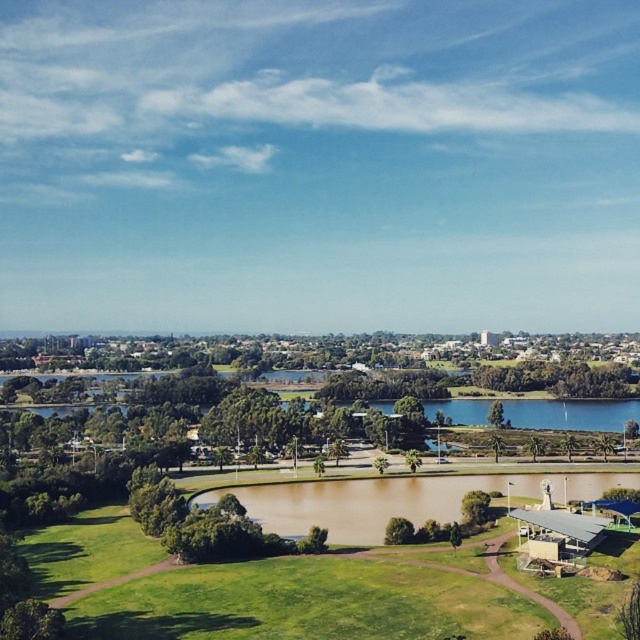
You are planning to host a picnic and need a spacious area. Based on the scene, which location between the green grassy golf course at lower left and the brown matte water at center would be more suitable for setting up your picnic spot?

The green grassy golf course at lower left is more suitable for a picnic spot because it has a larger size compared to the brown matte water at center.

You are a golfer standing on the green grassy golf course at lower left and want to hit a ball towards the brown matte water at center. Considering the potential width of the water, is there a chance the ball might land in the water?

The green grassy golf course at lower left might be wider than the brown matte water at center, so there is a possibility that the ball could land in the water if the shot is not precise enough.

You are a golfer standing on the green grassy golf course at lower left and want to hit a ball towards the brown matte water at center. Which direction should you aim to reach the water?

The green grassy golf course at lower left is positioned under the brown matte water at center, so you should aim upwards or forward to reach the water.